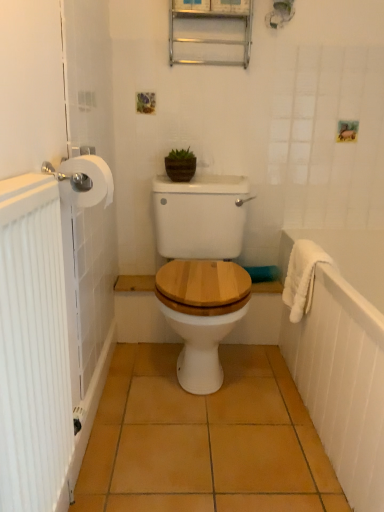
Question: Does point (370, 475) appear closer or farther from the camera than point (286, 274)?

Choices:
 (A) closer
 (B) farther

Answer: (A)

Question: From the image's perspective, relative to white fluffy bath towel at right, is white textured towel at right above or below?

Choices:
 (A) above
 (B) below

Answer: (B)

Question: Which object is positioned closest to the white textured towel at right?

Choices:
 (A) white ribbed radiator at left
 (B) white matte toilet paper at left
 (C) orange ceramic tile at center
 (D) metallic silver medicine cabinet at upper center
 (E) white fluffy bath towel at right

Answer: (E)

Question: Which object is positioned farthest from the green matte pot at center?

Choices:
 (A) orange ceramic tile at center
 (B) white ribbed radiator at left
 (C) white fluffy bath towel at right
 (D) white matte toilet paper at left
 (E) metallic silver medicine cabinet at upper center

Answer: (B)